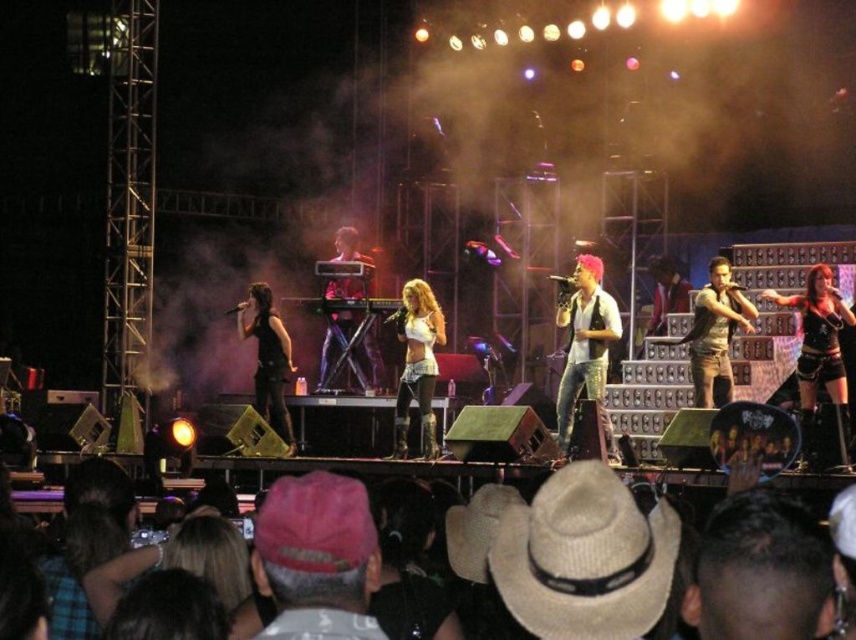
Question: Which object is closer to the camera taking this photo?

Choices:
 (A) pink fabric cap at lower center
 (B) black leather pants at center
 (C) white leather boots at center

Answer: (A)

Question: Estimate the real-world distances between objects in this image. Which object is farther from the shiny black keyboard at center?

Choices:
 (A) black leather pants at center
 (B) camouflage fabric shirt at center
 (C) white felt cowboy hat at center
 (D) black leather shorts at center

Answer: (C)

Question: Is shiny black keyboard at center bigger than metallic keyboard at center?

Choices:
 (A) no
 (B) yes

Answer: (B)

Question: Does pink sequined shirt at center have a greater width compared to camouflage fabric shirt at center?

Choices:
 (A) yes
 (B) no

Answer: (A)

Question: Can you confirm if pink fabric cap at lower center is wider than shiny black keyboard at center?

Choices:
 (A) yes
 (B) no

Answer: (A)

Question: Which point is closer to the camera?

Choices:
 (A) shiny black keyboard at center
 (B) dark brown hair at upper right

Answer: (B)